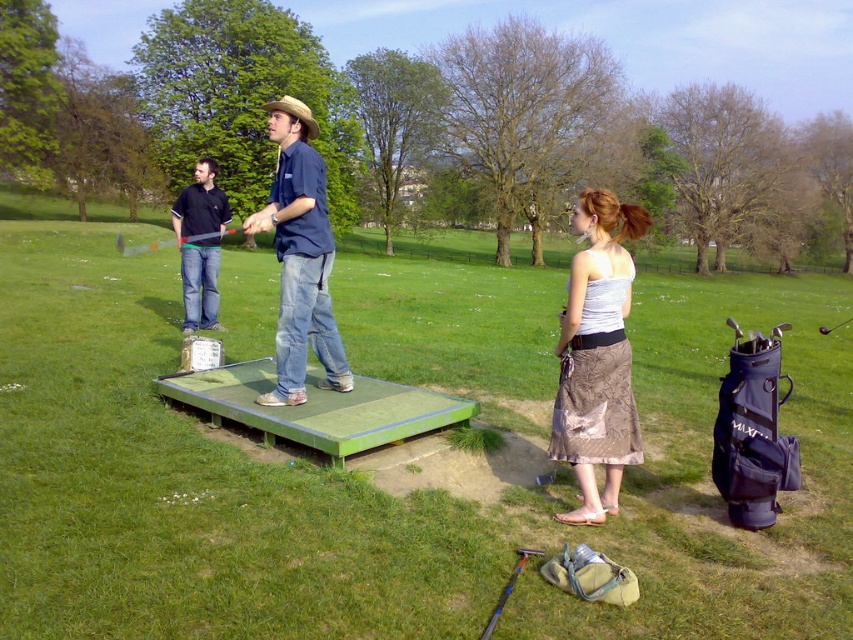
Can you confirm if matte black shirt at left is taller than metallic silver golf club at center?

No, matte black shirt at left is not taller than metallic silver golf club at center.

Is point (204, 182) positioned after point (131, 253)?

No, (204, 182) is closer to viewer.

Locate an element on the screen. matte black shirt at left is located at coordinates (200, 284).

I want to click on matte black shirt at left, so click(x=200, y=284).

You are a GUI agent. You are given a task and a screenshot of the screen. Output one action in this format:
    pyautogui.click(x=<x>, y=<y>)
    Task: Click on the green rubber mat at center
    The height and width of the screenshot is (640, 853).
    Given the screenshot: What is the action you would take?
    pyautogui.click(x=376, y=490)

Who is shorter, green rubber mat at center or metallic silver golf club at center?

Standing shorter between the two is metallic silver golf club at center.

Is point (343, 305) in front of point (143, 248)?

Yes, point (343, 305) is in front of point (143, 248).

Where is `green rubber mat at center`? Image resolution: width=853 pixels, height=640 pixels. green rubber mat at center is located at coordinates (376, 490).

Can you confirm if green rubber mat at center is positioned below silky brown skirt at lower right?

No.

Does green rubber mat at center appear on the right side of silky brown skirt at lower right?

In fact, green rubber mat at center is to the left of silky brown skirt at lower right.

Who is more forward, (x=531, y=296) or (x=572, y=300)?

Positioned in front is point (x=572, y=300).

This screenshot has width=853, height=640. I want to click on green rubber mat at center, so click(x=376, y=490).